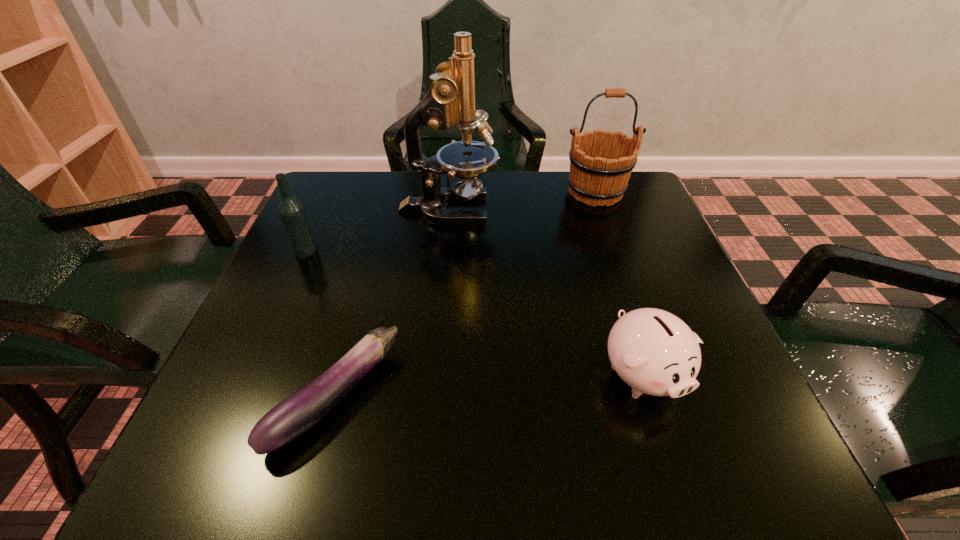
The width and height of the screenshot is (960, 540). What are the coordinates of `object situated at the far right corner` in the screenshot? It's located at (598, 176).

You are a GUI agent. You are given a task and a screenshot of the screen. Output one action in this format:
    pyautogui.click(x=<x>, y=<y>)
    Task: Click on the object that is at the near right corner
    This screenshot has height=540, width=960.
    Given the screenshot: What is the action you would take?
    pyautogui.click(x=653, y=351)

This screenshot has height=540, width=960. In the image, there is a desktop. In order to click on vacant space at the far edge in this screenshot , I will do `click(405, 216)`.

In the image, there is a desktop. Identify the location of vacant space at the near edge. (418, 444).

Identify the location of free space at the left edge of the desktop. The image size is (960, 540). (319, 336).

In the image, there is a desktop. Identify the location of free space at the right edge. (654, 291).

Find the location of a particular element. Image resolution: width=960 pixels, height=540 pixels. vacant space at the far left corner is located at coordinates (348, 180).

The image size is (960, 540). In the image, there is a desktop. Identify the location of vacant space at the near left corner. (232, 450).

This screenshot has width=960, height=540. In the image, there is a desktop. In order to click on vacant region at the far right corner in this screenshot , I will do `click(648, 202)`.

The width and height of the screenshot is (960, 540). What are the coordinates of `unoccupied position between the piggy bank and the shortest object` in the screenshot? It's located at [489, 386].